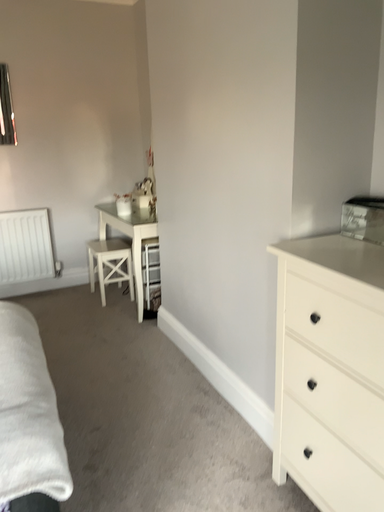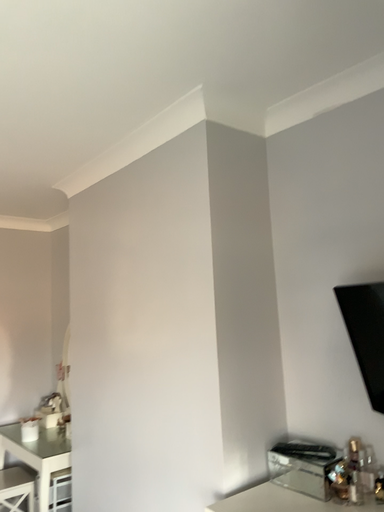
Question: How did the camera likely rotate when shooting the video?

Choices:
 (A) rotated downward
 (B) rotated upward

Answer: (B)